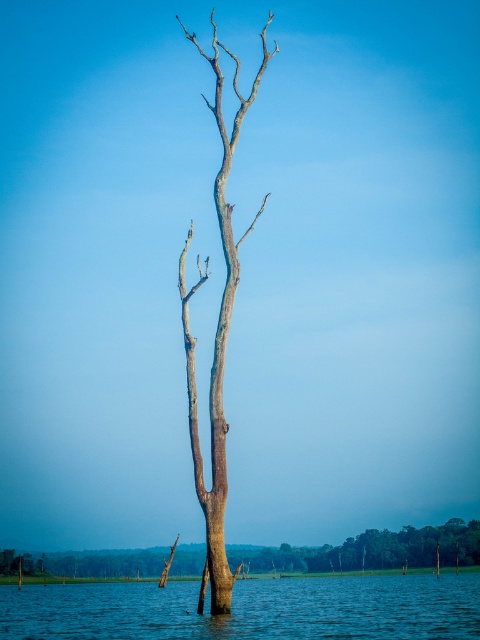
Question: Which point appears farthest from the camera in this image?

Choices:
 (A) (7, 557)
 (B) (408, 634)

Answer: (A)

Question: Which point is closer to the camera?

Choices:
 (A) (227, 429)
 (B) (274, 605)

Answer: (A)

Question: Considering the relative positions of blue liquid water at center and smooth gray bark tree at center in the image provided, where is blue liquid water at center located with respect to smooth gray bark tree at center?

Choices:
 (A) right
 (B) left

Answer: (A)

Question: Is brown rough tree trunk at center to the left of smooth gray bark tree at center from the viewer's perspective?

Choices:
 (A) yes
 (B) no

Answer: (A)

Question: Can you confirm if blue liquid water at center is positioned to the right of smooth gray bark tree at center?

Choices:
 (A) no
 (B) yes

Answer: (B)

Question: Which point appears farthest from the camera in this image?

Choices:
 (A) (68, 568)
 (B) (219, 600)
 (C) (447, 573)

Answer: (A)